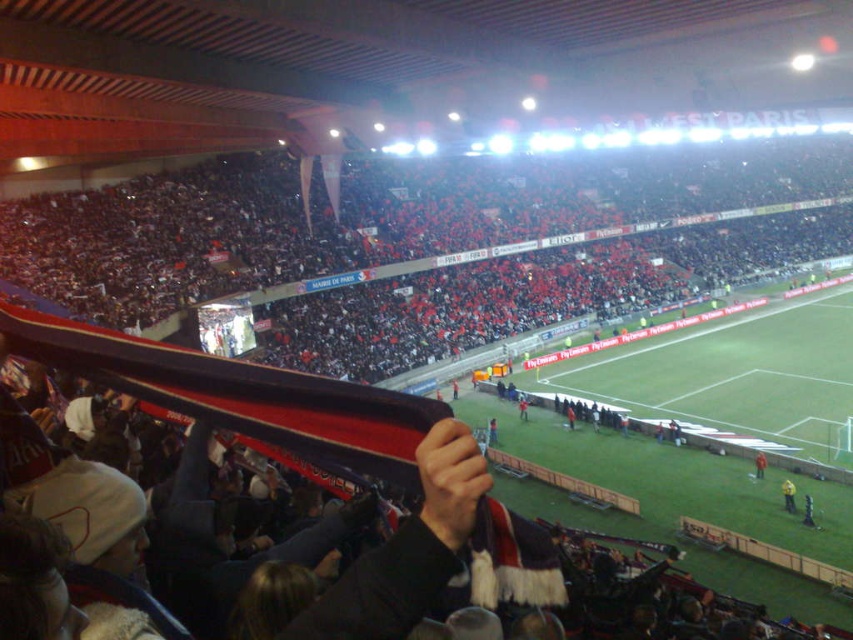
Question: In this image, where is red and white striped scarf at center located relative to red fabric scarf at lower right?

Choices:
 (A) above
 (B) below

Answer: (A)

Question: Is red and white striped scarf at center bigger than yellow fabric at lower right?

Choices:
 (A) yes
 (B) no

Answer: (A)

Question: Which of the following is the closest to the observer?

Choices:
 (A) red and white striped scarf at center
 (B) red fabric crowd at upper center
 (C) yellow fabric at lower right
 (D) red fabric scarf at lower right

Answer: (A)

Question: Which point is closer to the camera taking this photo?

Choices:
 (A) (397, 461)
 (B) (763, 461)

Answer: (A)

Question: Can you confirm if yellow fabric at lower right is positioned above red fabric scarf at lower right?

Choices:
 (A) yes
 (B) no

Answer: (B)

Question: Estimate the real-world distances between objects in this image. Which object is closer to the yellow fabric at lower right?

Choices:
 (A) red and white striped scarf at center
 (B) red fabric crowd at upper center
 (C) red fabric scarf at lower right

Answer: (C)